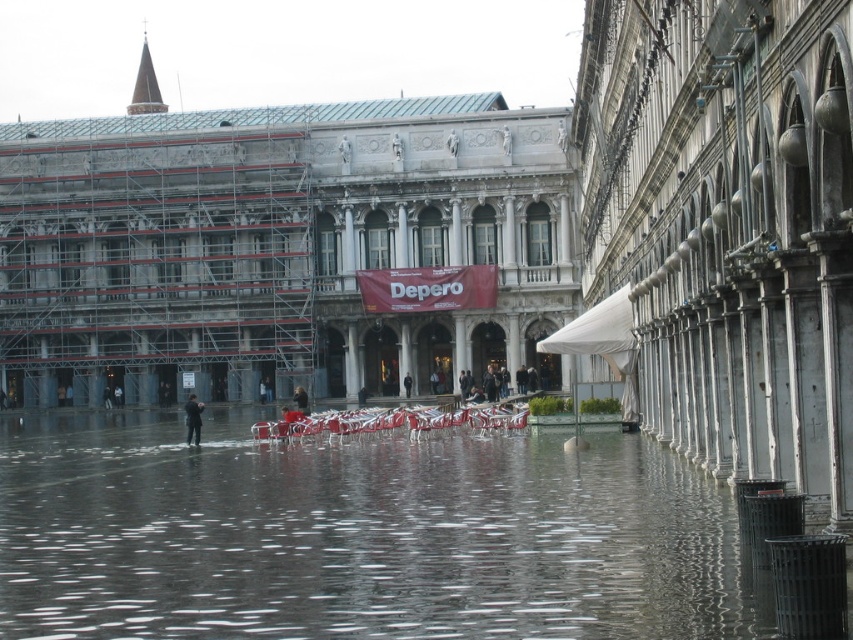
Question: Which point is closer to the camera?

Choices:
 (A) black leather jacket at center
 (B) rusty metal columns at right
 (C) stone marble palace at center
 (D) clear water at center

Answer: (D)

Question: Is stone marble palace at center closer to the viewer compared to dark suit at center?

Choices:
 (A) no
 (B) yes

Answer: (A)

Question: Is stone marble palace at center smaller than clear water at center?

Choices:
 (A) yes
 (B) no

Answer: (B)

Question: Does stone marble palace at center appear on the right side of rusty metal columns at right?

Choices:
 (A) yes
 (B) no

Answer: (B)

Question: Which is nearer to the clear water at center?

Choices:
 (A) stone marble palace at center
 (B) rusty metal columns at right
 (C) black leather jacket at center

Answer: (B)

Question: Which of the following is the farthest from the observer?

Choices:
 (A) (328, 234)
 (B) (187, 440)

Answer: (A)